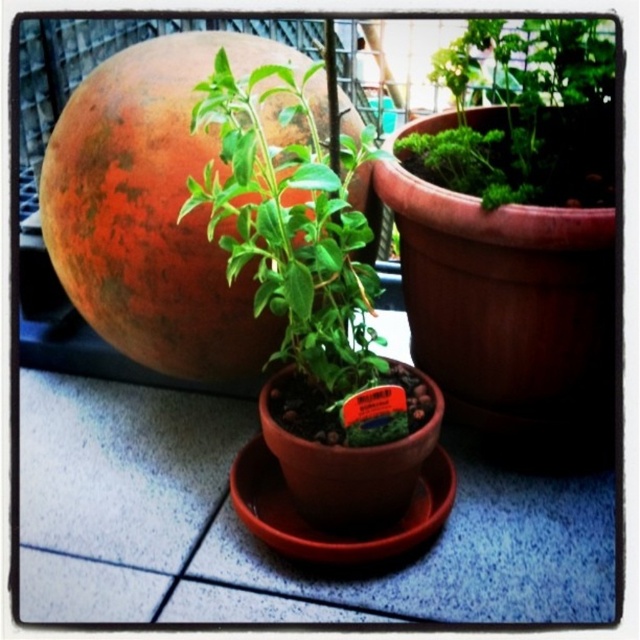
Question: Which of the following is the farthest from the observer?

Choices:
 (A) (611, 52)
 (B) (205, 317)

Answer: (B)

Question: Is matte orange sphere at upper left below green leafy plant at center?

Choices:
 (A) no
 (B) yes

Answer: (B)

Question: Which point is closer to the camera?

Choices:
 (A) matte orange sphere at upper left
 (B) green leafy plant at center

Answer: (B)

Question: Which point is farther to the camera?

Choices:
 (A) green leafy plant at center
 (B) matte orange sphere at upper left

Answer: (B)

Question: Can you confirm if matte orange sphere at upper left is positioned to the left of green leafy plant at center?

Choices:
 (A) no
 (B) yes

Answer: (B)

Question: Does matte orange sphere at upper left have a larger size compared to green leafy plant at center?

Choices:
 (A) no
 (B) yes

Answer: (B)